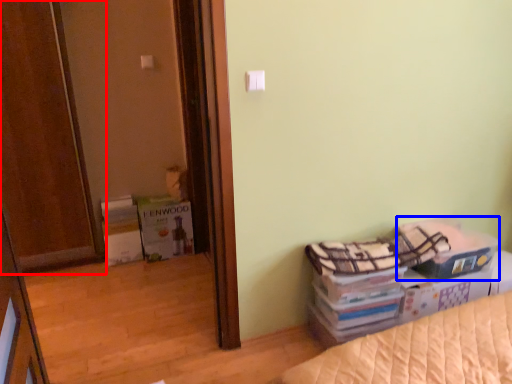
Question: Which object is further to the camera taking this photo, door (highlighted by a red box) or storage box (highlighted by a blue box)?

Choices:
 (A) door
 (B) storage box

Answer: (B)